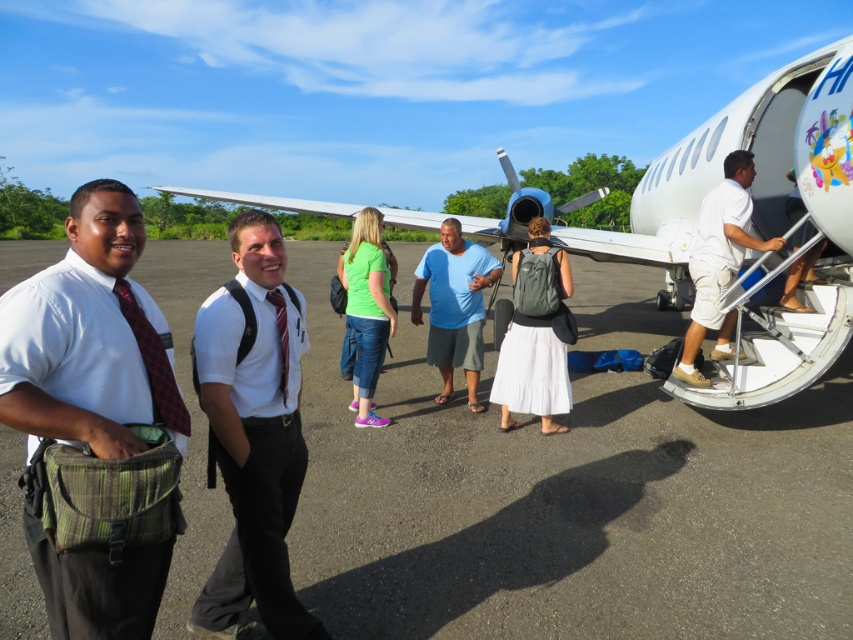
Question: Among these objects, which one is nearest to the camera?

Choices:
 (A) white woven bag at left
 (B) smooth asphalt tarmac at center

Answer: (A)

Question: Estimate the real-world distances between objects in this image. Which object is farther from the red silk tie at center?

Choices:
 (A) white woven bag at left
 (B) blue cotton shirt at center
 (C) green matte shirt at center

Answer: (B)

Question: Estimate the real-world distances between objects in this image. Which object is farther from the blue cotton shirt at center?

Choices:
 (A) red plaid tie at left
 (B) red silk tie at center
 (C) smooth asphalt tarmac at center
 (D) white matte airplane at right

Answer: (A)

Question: Does smooth asphalt tarmac at center appear over white shirt at center?

Choices:
 (A) no
 (B) yes

Answer: (B)

Question: Is white cotton shirt at right to the left of green matte shirt at center from the viewer's perspective?

Choices:
 (A) yes
 (B) no

Answer: (B)

Question: Does matte gray backpack at center come behind red plaid tie at left?

Choices:
 (A) no
 (B) yes

Answer: (B)